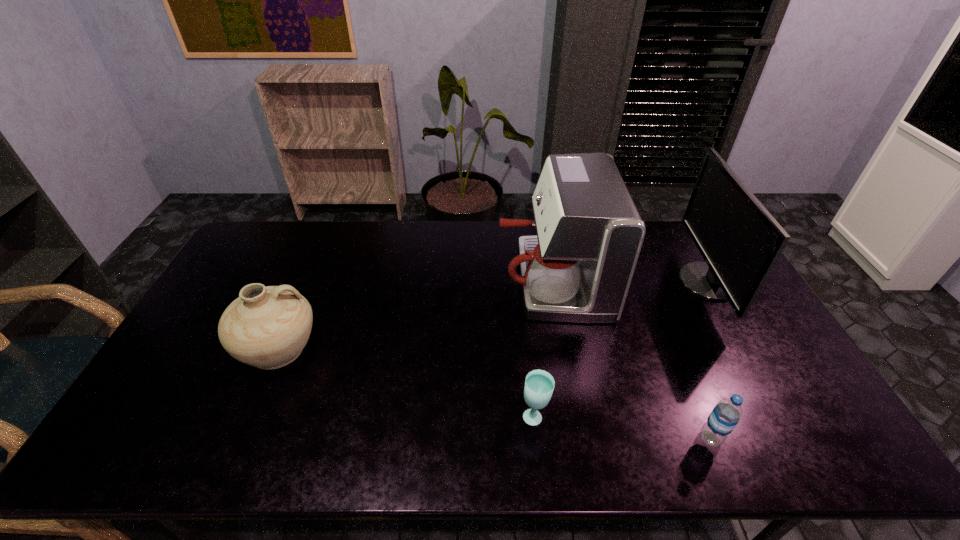
Find the location of a particular element. free spot located 0.100m on the front of the coffee maker near the spout is located at coordinates (468, 280).

The image size is (960, 540). I want to click on vacant region located 0.380m on the screen side of the monitor, so click(x=565, y=282).

Where is `vacant space located 0.350m on the screen side of the monitor`? This screenshot has height=540, width=960. vacant space located 0.350m on the screen side of the monitor is located at coordinates (575, 282).

In order to click on blank space located on the screen side of the monitor in this screenshot , I will do `click(581, 282)`.

Image resolution: width=960 pixels, height=540 pixels. Find the location of `free space located 0.070m on the left of the third tallest object`. free space located 0.070m on the left of the third tallest object is located at coordinates (213, 348).

Find the location of `vacant region located on the label of the water bottle`. vacant region located on the label of the water bottle is located at coordinates (653, 438).

What are the coordinates of `vacant region located 0.290m on the label of the water bottle` in the screenshot? It's located at (578, 438).

Locate an element on the screen. vacant space located on the label of the water bottle is located at coordinates (620, 438).

What are the coordinates of `vacant area situated on the left of the shortest object` in the screenshot? It's located at (469, 416).

Locate an element on the screen. The width and height of the screenshot is (960, 540). coffee maker located in the far edge section of the desktop is located at coordinates (579, 267).